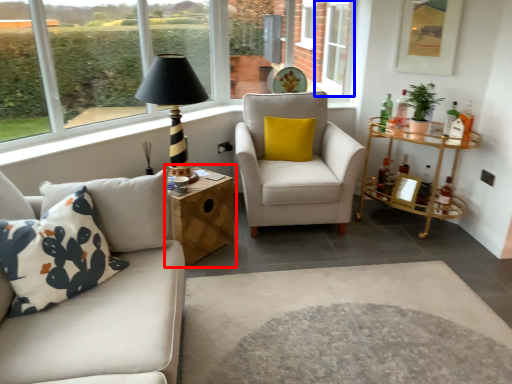
Question: Which object appears closest to the camera in this image, table (highlighted by a red box) or window (highlighted by a blue box)?

Choices:
 (A) table
 (B) window

Answer: (A)